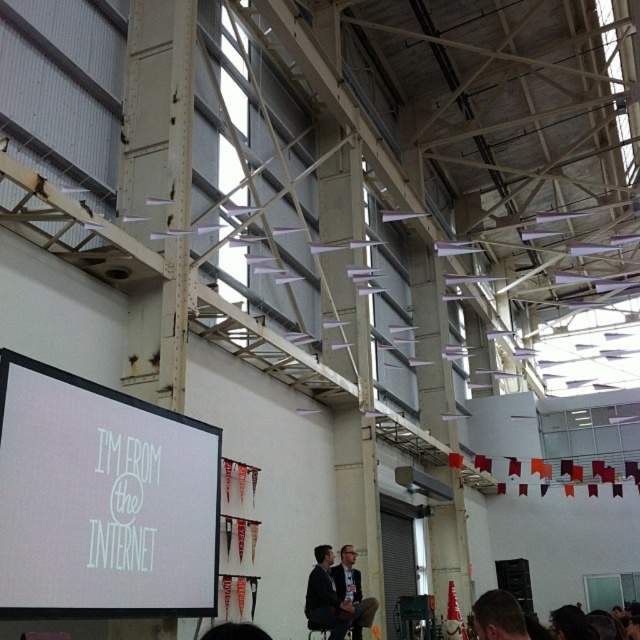
Is white matte projection screen at upper left to the right of dark gray suit at center from the viewer's perspective?

No, white matte projection screen at upper left is not to the right of dark gray suit at center.

Locate an element on the screen. white matte projection screen at upper left is located at coordinates (100, 500).

Between dark gray suit at center and brown hair at lower center, which one appears on the left side from the viewer's perspective?

From the viewer's perspective, dark gray suit at center appears more on the left side.

The height and width of the screenshot is (640, 640). Describe the element at coordinates (324, 596) in the screenshot. I see `dark gray suit at center` at that location.

You are a GUI agent. You are given a task and a screenshot of the screen. Output one action in this format:
    pyautogui.click(x=<x>, y=<y>)
    Task: Click on the dark gray suit at center
    This screenshot has height=640, width=640.
    Given the screenshot: What is the action you would take?
    pyautogui.click(x=324, y=596)

Which is behind, point (102, 525) or point (524, 625)?

The point (102, 525) is more distant.

Is point (172, 566) positioned after point (477, 605)?

Yes, point (172, 566) is farther from viewer.

Is point (97, 440) positioned before point (525, 637)?

No, (97, 440) is behind (525, 637).

Locate an element on the screen. The image size is (640, 640). white matte projection screen at upper left is located at coordinates (100, 500).